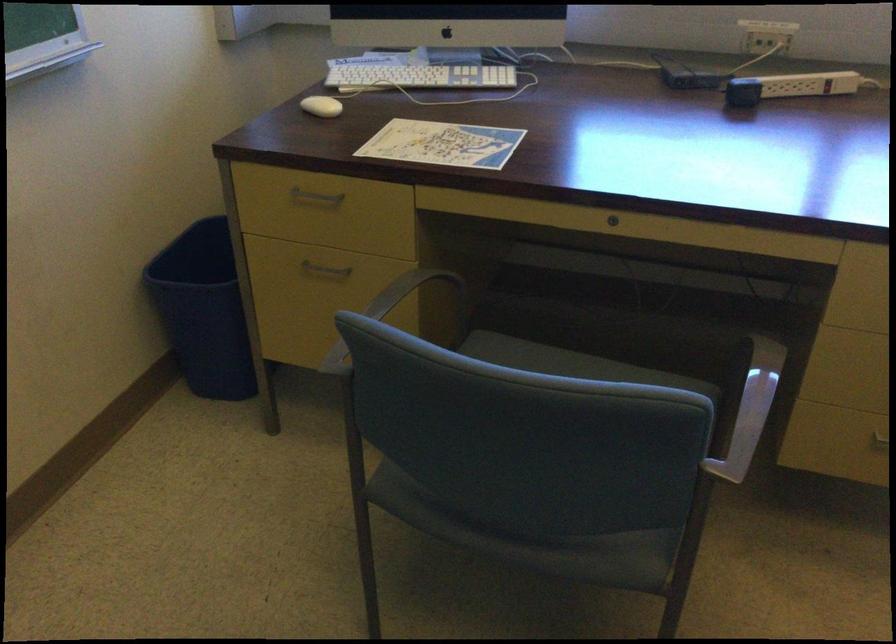
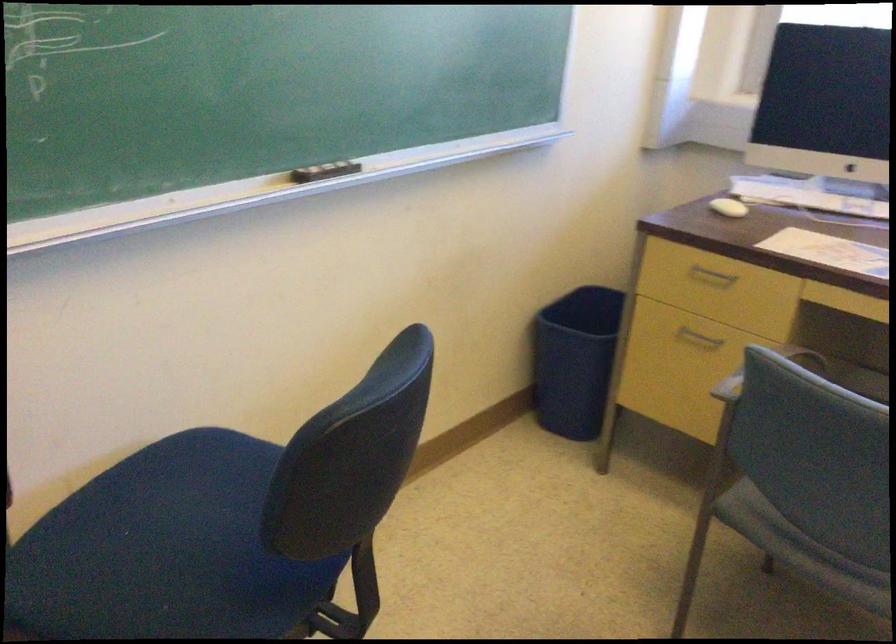
Question: How did the camera likely rotate?

Choices:
 (A) Left
 (B) Right
 (C) Up
 (D) Down

Answer: (A)